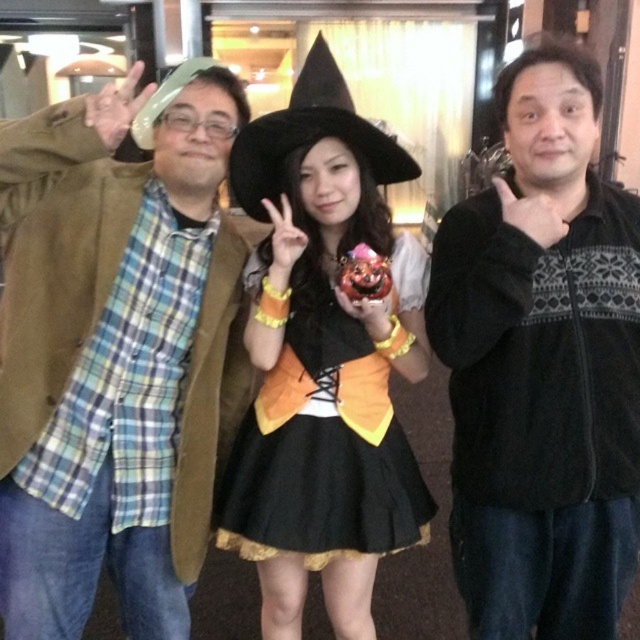
You are a photographer at the event and need to adjust the camera focus. The minimum focus distance of your camera is 25 inches. Can you focus on both the brown suede jacket at left and the black velvety jacket at center without moving the camera?

The brown suede jacket at left and the black velvety jacket at center are 30.76 inches apart. Since the minimum focus distance is 25 inches, the camera can focus on both jackets as they are within the required distance.

You are a photographer trying to capture the perfect shot of the black velvety jacket at center. The camera you are using has a focal length of 50mm. If the point at coordinates (541, 365) is where you want to focus, how does this coordinate relate to the jacket?

The point at coordinates (541, 365) corresponds to the black velvety jacket at center, indicating that this is the exact location on the image where the jacket is positioned. By focusing on this point, you will ensure the jacket is sharply captured in the photograph.